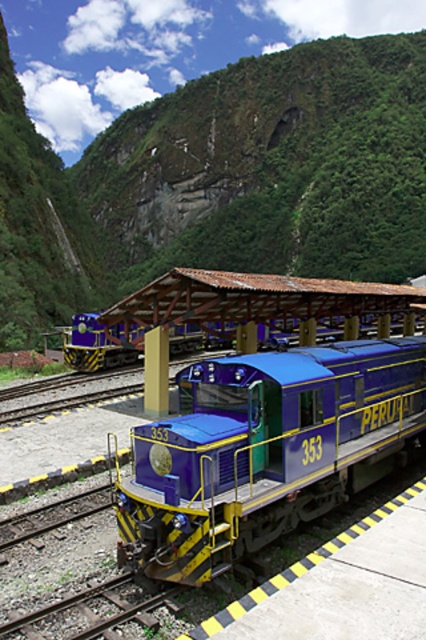
Which is more to the left, metallic blue train at center or matte blue train at center?

From the viewer's perspective, metallic blue train at center appears more on the left side.

You are a GUI agent. You are given a task and a screenshot of the screen. Output one action in this format:
    pyautogui.click(x=<x>, y=<y>)
    Task: Click on the metallic blue train at center
    
    Given the screenshot: What is the action you would take?
    pyautogui.click(x=264, y=451)

Which is in front, point (250, 438) or point (74, 358)?

Point (250, 438) is more forward.

The image size is (426, 640). What are the coordinates of `metallic blue train at center` in the screenshot? It's located at (264, 451).